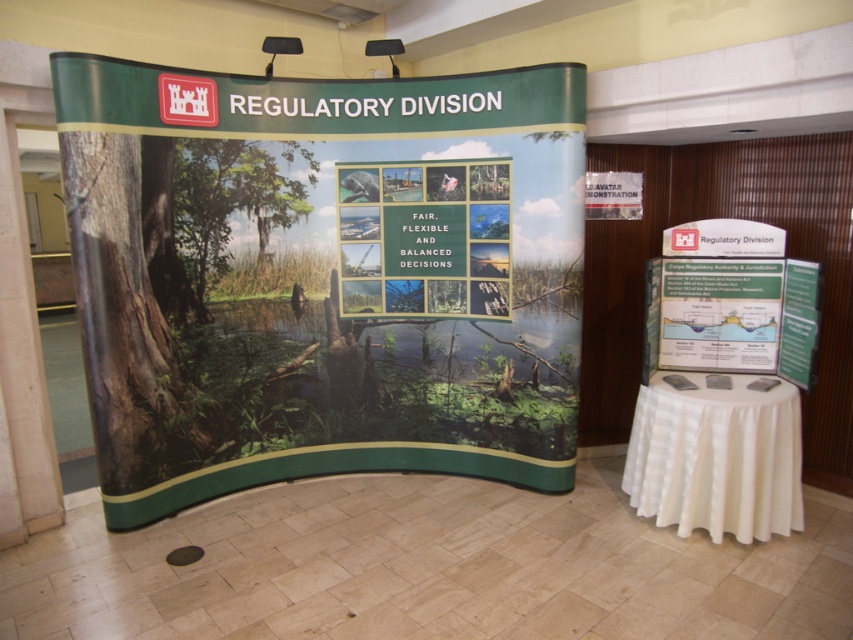
Does point (506, 284) come closer to viewer compared to point (740, 486)?

That is False.

This screenshot has width=853, height=640. What do you see at coordinates (322, 275) in the screenshot? I see `matte green poster at center` at bounding box center [322, 275].

Image resolution: width=853 pixels, height=640 pixels. I want to click on matte green poster at center, so click(322, 275).